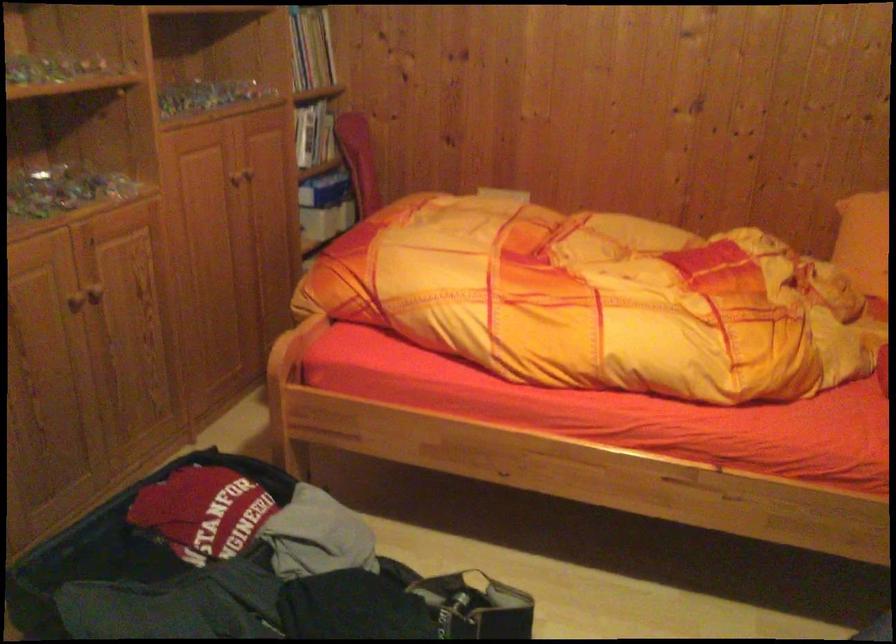
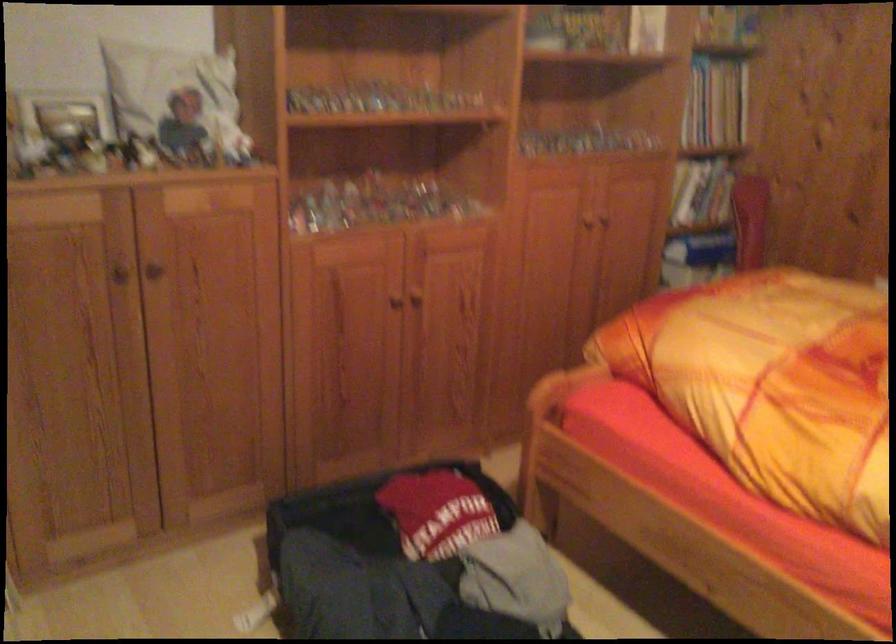
Question: The camera is either moving clockwise (left) or counter-clockwise (right) around the object. The first image is from the beginning of the video and the second image is from the end. Is the camera moving left or right when shooting the video?

Choices:
 (A) Left
 (B) Right

Answer: (B)